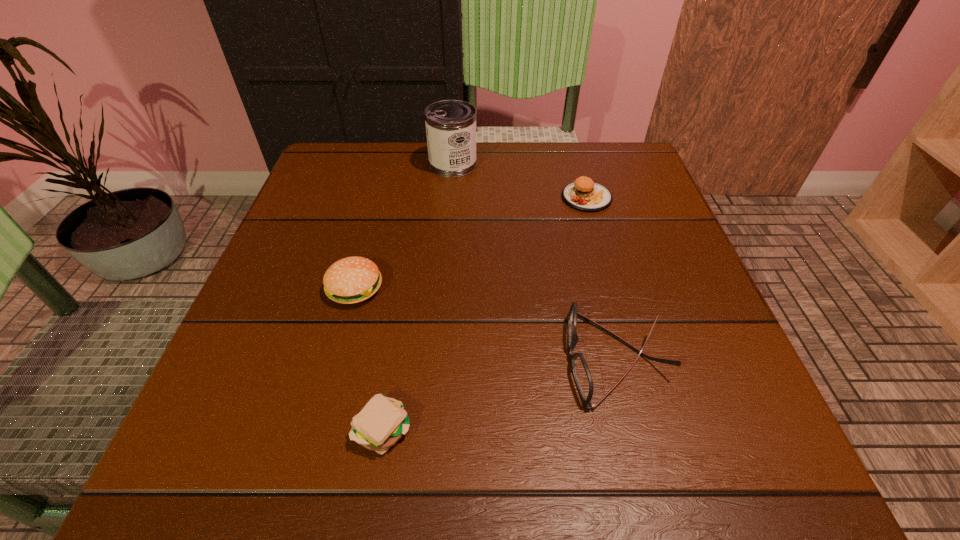
This screenshot has height=540, width=960. What are the coordinates of `free region at the near edge` in the screenshot? It's located at (484, 454).

At what (x,y) coordinates should I click in order to perform the action: click on free space at the left edge of the desktop. Please return your answer as a coordinate pair (x, y). The width and height of the screenshot is (960, 540). Looking at the image, I should click on (246, 369).

At what (x,y) coordinates should I click in order to perform the action: click on free location at the right edge of the desktop. Please return your answer as a coordinate pair (x, y). This screenshot has width=960, height=540. Looking at the image, I should click on (610, 202).

In the image, there is a desktop. Identify the location of vacant space at the far right corner. The height and width of the screenshot is (540, 960). (624, 160).

I want to click on free space that is in between the nearest patty and the second nearest patty, so click(x=369, y=358).

Where is `free space between the farthest object and the leftmost object`? Image resolution: width=960 pixels, height=540 pixels. free space between the farthest object and the leftmost object is located at coordinates (470, 243).

Where is `empty space that is in between the spectacles and the rightmost patty`? empty space that is in between the spectacles and the rightmost patty is located at coordinates (602, 278).

Identify the location of free space that is in between the second farthest patty and the farthest object. The height and width of the screenshot is (540, 960). (470, 243).

Image resolution: width=960 pixels, height=540 pixels. In order to click on empty space between the shortest object and the rightmost patty in this screenshot , I will do pos(485,313).

Locate an element on the screen. This screenshot has width=960, height=540. unoccupied area between the leftmost object and the farthest patty is located at coordinates (470, 243).